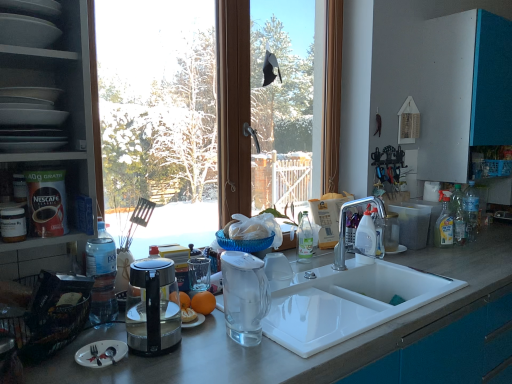
I want to click on vacant area that is in front of clear plastic bottle at right, the 1th bottle viewed from the back, so click(x=486, y=246).